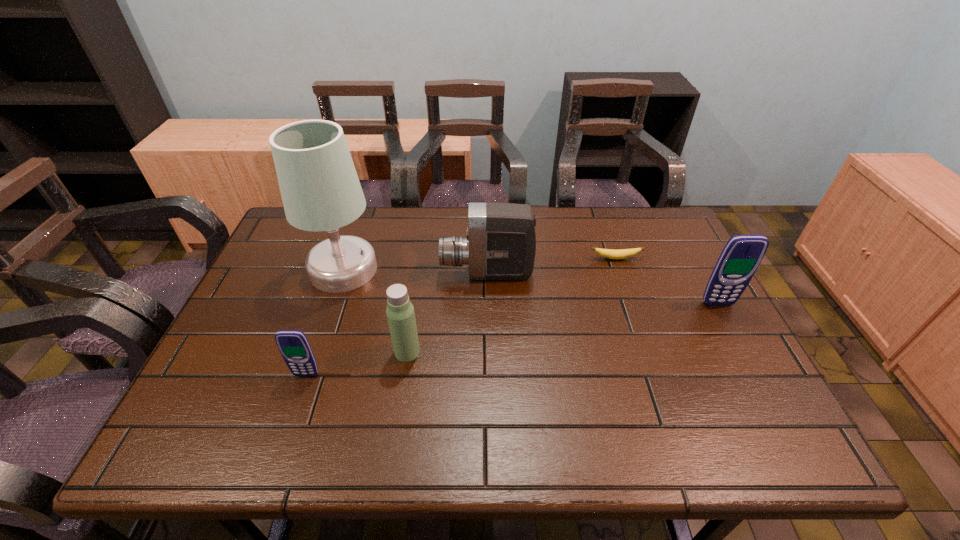
You are a GUI agent. You are given a task and a screenshot of the screen. Output one action in this format:
    pyautogui.click(x=<x>, y=<y>)
    Task: Click on the left cellular telephone
    This screenshot has width=960, height=540.
    Given the screenshot: What is the action you would take?
    pyautogui.click(x=294, y=347)

Locate an element on the screen. This screenshot has height=540, width=960. the nearest object is located at coordinates (294, 347).

Locate an element on the screen. The image size is (960, 540). the third nearest object is located at coordinates (742, 254).

At what (x,y) coordinates should I click in order to perform the action: click on the farther cellular telephone. Please return your answer as a coordinate pair (x, y). Image resolution: width=960 pixels, height=540 pixels. Looking at the image, I should click on (742, 254).

Find the location of a particular element. the second object from right to left is located at coordinates (608, 253).

Locate an element on the screen. the shortest object is located at coordinates (608, 253).

This screenshot has width=960, height=540. In order to click on the third object from right to left in this screenshot , I will do `click(501, 241)`.

I want to click on the tallest object, so (x=320, y=189).

This screenshot has width=960, height=540. What are the coordinates of `the fifth farthest object` in the screenshot? It's located at (400, 313).

What are the coordinates of `thermos bottle` in the screenshot? It's located at (400, 313).